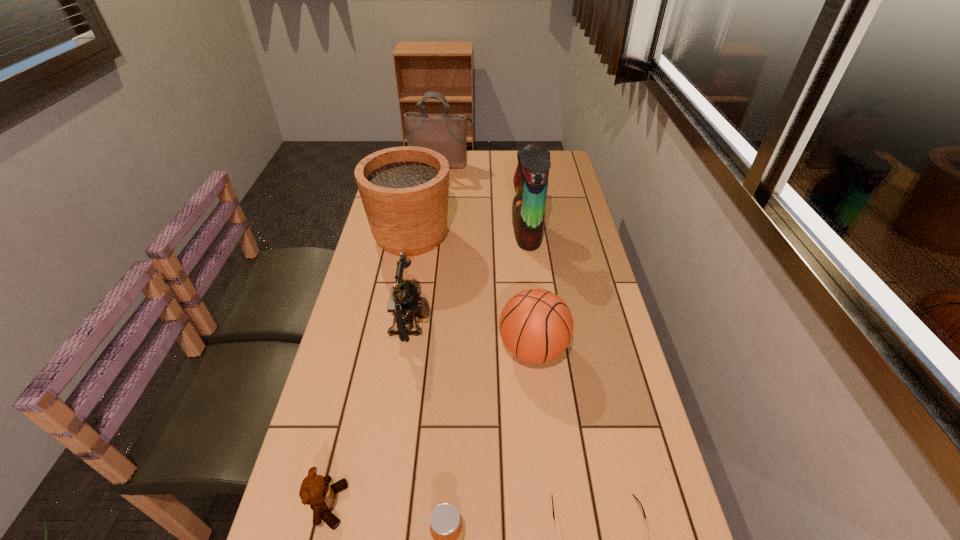
Find the location of a particular element. The height and width of the screenshot is (540, 960). shoulder bag is located at coordinates pyautogui.click(x=445, y=134).

Locate an element on the screen. parrot is located at coordinates coord(530,180).

This screenshot has width=960, height=540. Find the location of `flowerpot`. flowerpot is located at coordinates (404, 190).

Identify the location of telephone. This screenshot has width=960, height=540. (405, 303).

You are a GUI agent. You are given a task and a screenshot of the screen. Output one action in this format:
    pyautogui.click(x=<x>, y=<y>)
    Task: Click on the basketball
    The height and width of the screenshot is (540, 960).
    Given the screenshot: What is the action you would take?
    pyautogui.click(x=536, y=325)

Locate an element on the screen. The width and height of the screenshot is (960, 540). teddy bear is located at coordinates coord(315,491).

Identify the location of vacant space located on the front-facing side of the shoulder bag. This screenshot has width=960, height=540. (435, 215).

This screenshot has width=960, height=540. Identify the location of free space located at the face of the parrot. (425, 232).

At what (x,y) coordinates should I click in order to perform the action: click on vacant region located 0.060m at the face of the parrot. Please return your answer as a coordinate pair (x, y). This screenshot has width=960, height=540. Looking at the image, I should click on (494, 232).

Identify the location of vacant space located at the face of the parrot. The image size is (960, 540). (448, 232).